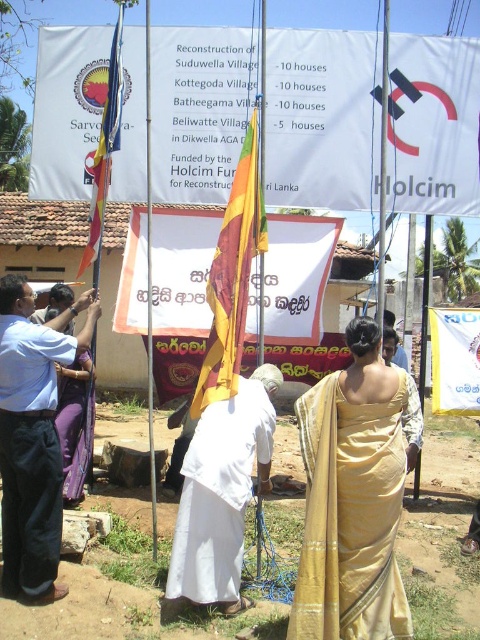
Question: Which object is farther from the camera taking this photo?

Choices:
 (A) yellow-green fabric flag at center
 (B) purple silk saree at lower left
 (C) gold silk saree at center
 (D) white cloth at center

Answer: (B)

Question: Is gold silk saree at center to the right of yellow-green fabric flag at center from the viewer's perspective?

Choices:
 (A) no
 (B) yes

Answer: (B)

Question: Is light blue shirt at center below yellow-green fabric flag at center?

Choices:
 (A) no
 (B) yes

Answer: (B)

Question: Does light blue shirt at center appear on the right side of purple silk saree at lower left?

Choices:
 (A) yes
 (B) no

Answer: (A)

Question: Considering the real-world distances, which object is closest to the matte fabric flag at left?

Choices:
 (A) white cloth at center
 (B) purple silk saree at lower left

Answer: (B)

Question: Which object is closer to the camera taking this photo?

Choices:
 (A) matte fabric flag at left
 (B) light blue shirt at center

Answer: (B)